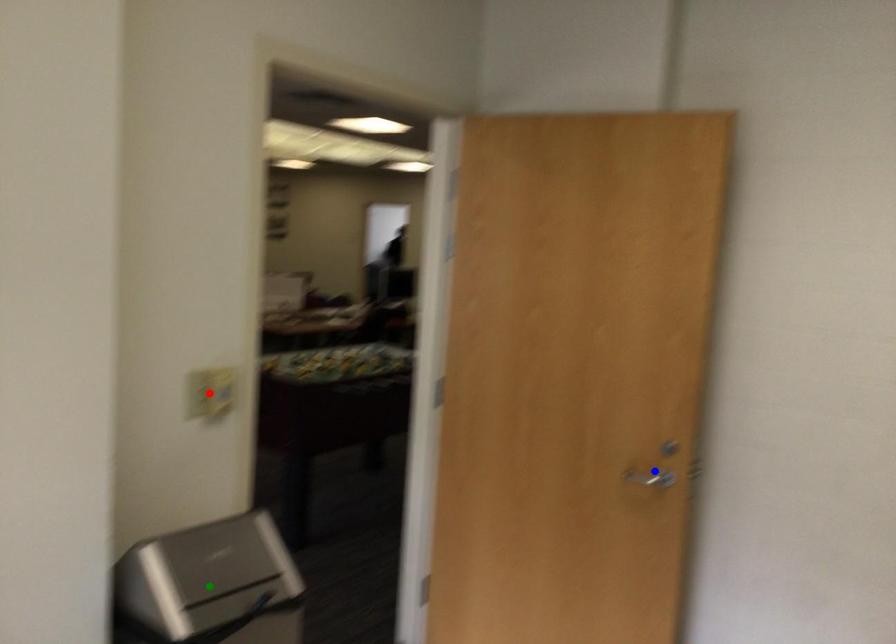
Order these from nearest to farthest:
A) red point
B) green point
C) blue point

1. green point
2. red point
3. blue point